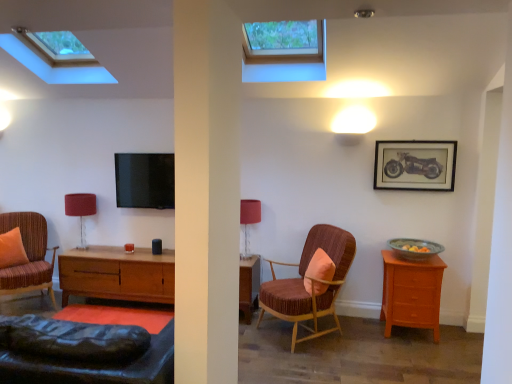
You are a GUI agent. You are given a task and a screenshot of the screen. Output one action in this format:
    pyautogui.click(x=<x>, y=<y>)
    Task: Click on the free spot to the left of light brown wood nightstand at right
    Image resolution: width=512 pixels, height=384 pixels.
    Given the screenshot: What is the action you would take?
    pyautogui.click(x=362, y=337)